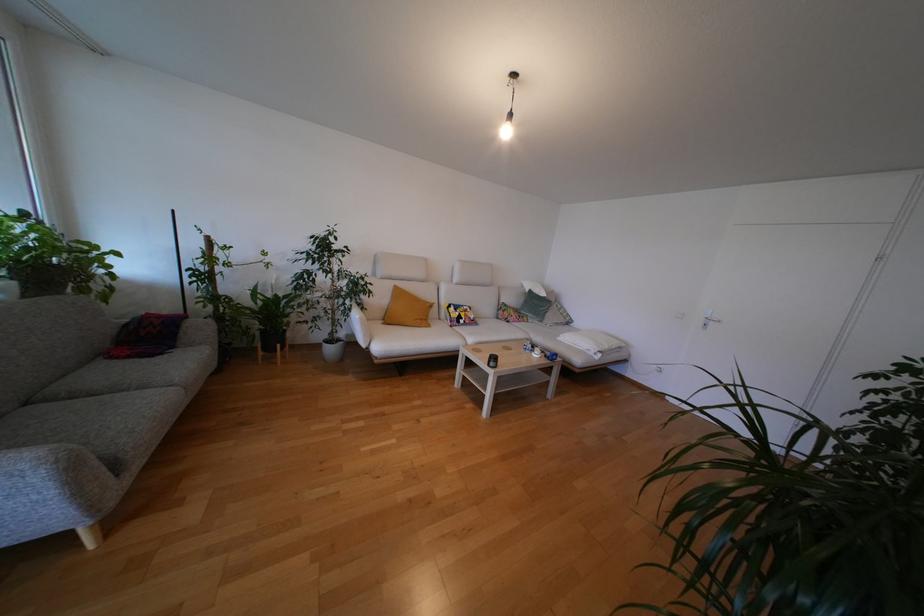
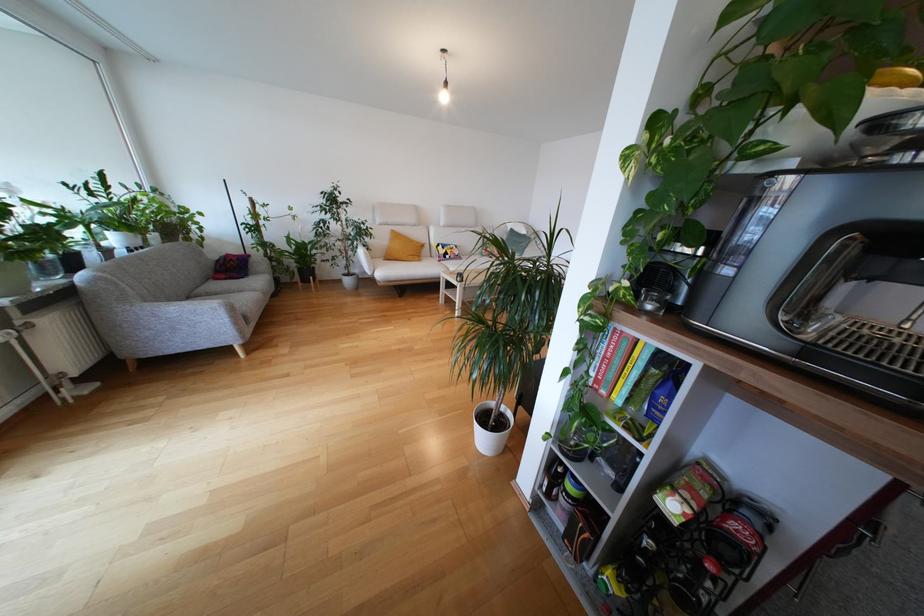
Find the pixel in the second image that matches the point at 463,326 in the first image.

(448, 262)